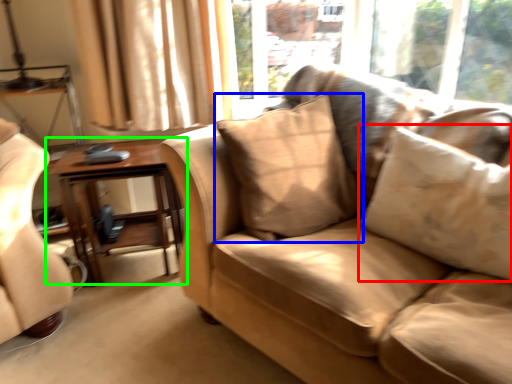
Question: Considering the real-world distances, which object is closest to pillow (highlighted by a red box)? pillow (highlighted by a blue box) or table (highlighted by a green box).

Choices:
 (A) pillow
 (B) table

Answer: (A)